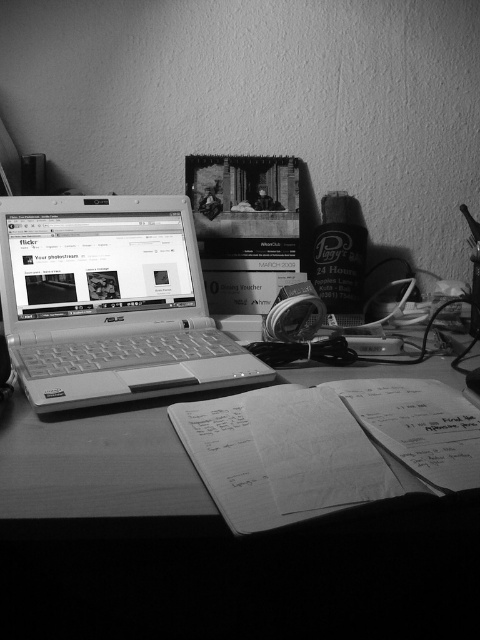
Is metallic silver laptop at left below white paper at center?

No.

Does metallic silver laptop at left have a lesser width compared to white paper at center?

No, metallic silver laptop at left is not thinner than white paper at center.

Which is behind, point (79, 266) or point (422, 481)?

Positioned behind is point (79, 266).

I want to click on metallic silver laptop at left, so click(109, 301).

Is point (303, 444) behind point (158, 490)?

That is True.

Can you confirm if white paper at center is positioned to the right of wooden table at center?

Indeed, white paper at center is positioned on the right side of wooden table at center.

What do you see at coordinates (326, 445) in the screenshot?
I see `white paper at center` at bounding box center [326, 445].

Where is `white paper at center`? This screenshot has width=480, height=640. white paper at center is located at coordinates (326, 445).

Is point (43, 308) positioned in front of point (34, 481)?

No.

Between metallic silver laptop at left and wooden table at center, which one has less height?

With less height is wooden table at center.

Image resolution: width=480 pixels, height=640 pixels. I want to click on metallic silver laptop at left, so click(x=109, y=301).

The height and width of the screenshot is (640, 480). What are the coordinates of `metallic silver laptop at left` in the screenshot? It's located at point(109,301).